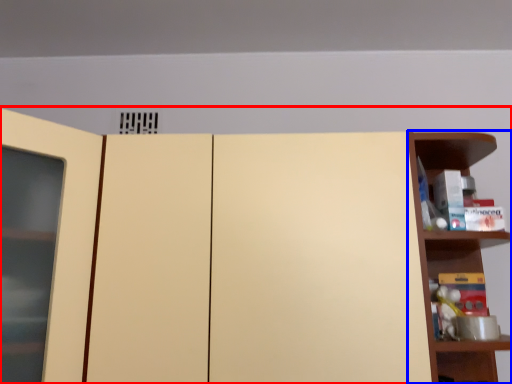
Question: Which object appears farthest to the camera in this image, cupboard (highlighted by a red box) or shelf (highlighted by a blue box)?

Choices:
 (A) cupboard
 (B) shelf

Answer: (B)